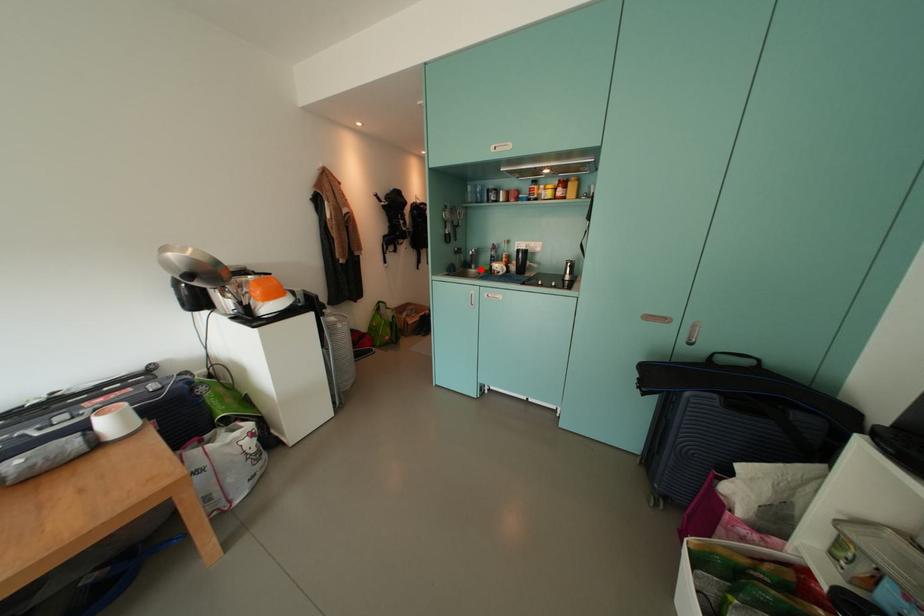
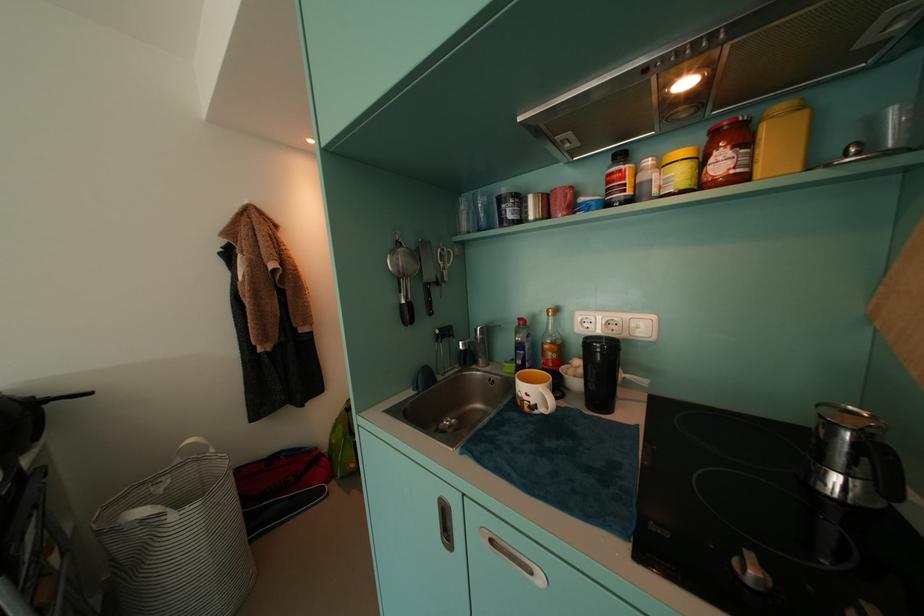
Question: A red point is marked in image1. In image2, is the corresponding 3D point closer to the camera or farther? Reply with the corresponding letter.

Choices:
 (A) The corresponding 3D point is closer.
 (B) The corresponding 3D point is farther.

Answer: (B)